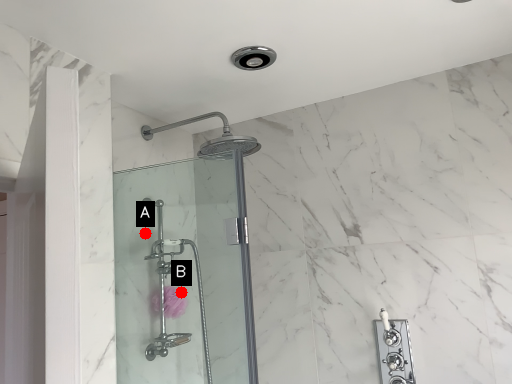
Question: Two points are circled on the image, labeled by A and B beside each circle. Which of the following is the farthest from the observer?

Choices:
 (A) A is further
 (B) B is further

Answer: (A)